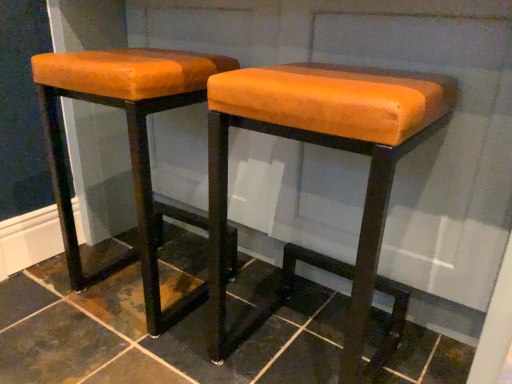
Identify the location of free spot to the right of orange leather stool at left, which is counted as the first stool, starting from the left. The width and height of the screenshot is (512, 384). (259, 286).